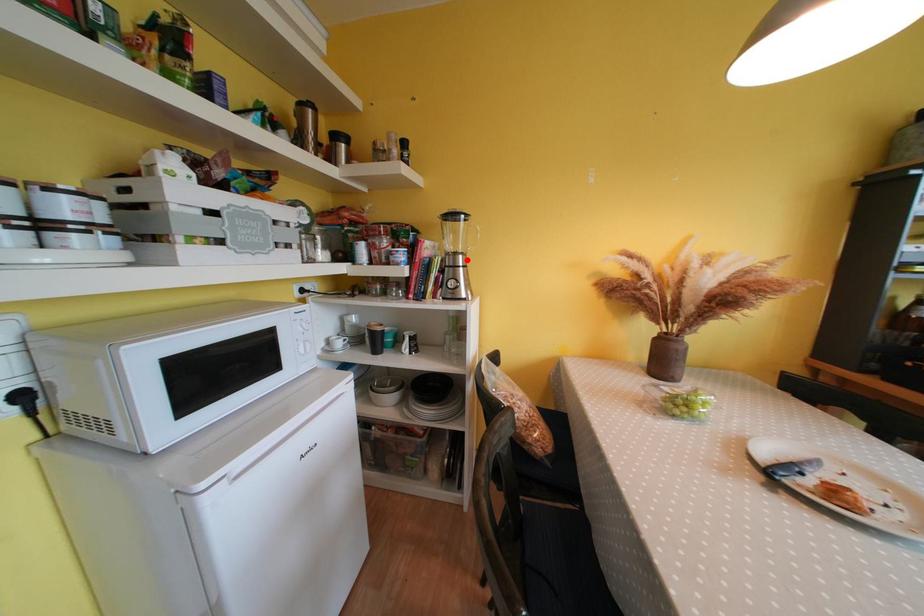
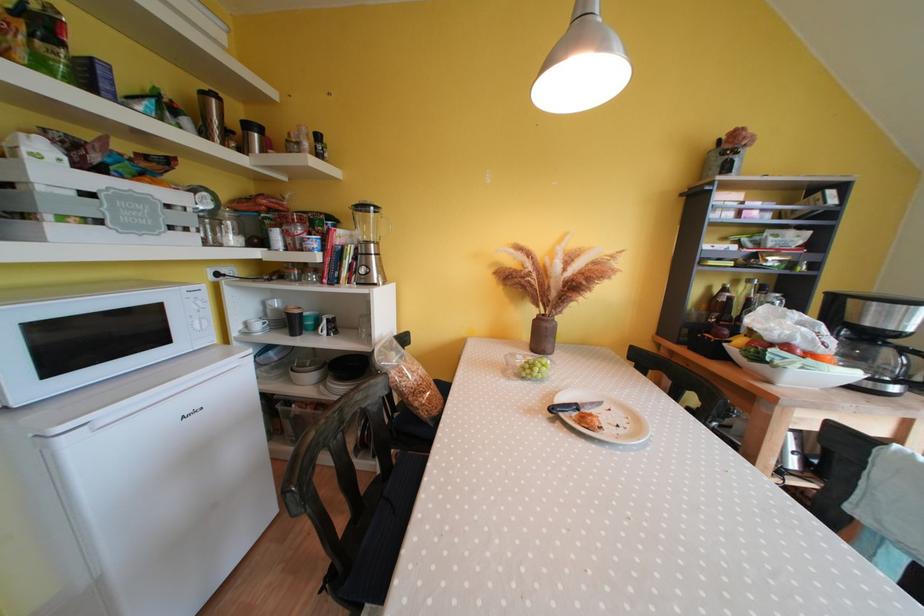
In the second image, find the point that corresponds to the highlighted location in the first image.

(379, 249)